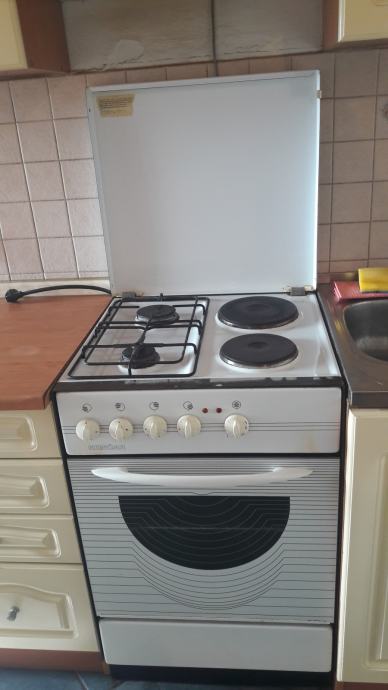
Find the location of a particular element. The width and height of the screenshot is (388, 690). back covered burner is located at coordinates (269, 313).